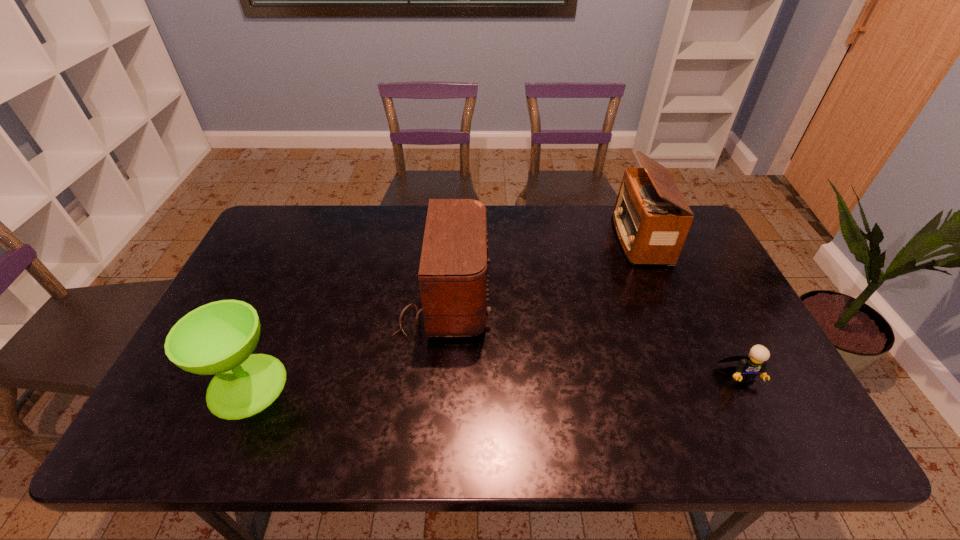
At what (x,y) coordinates should I click in order to perform the action: click on free space at the right edge. Please return your answer as a coordinate pair (x, y). The height and width of the screenshot is (540, 960). Looking at the image, I should click on (702, 314).

Locate an element on the screen. The height and width of the screenshot is (540, 960). vacant space at the far left corner of the desktop is located at coordinates (294, 237).

The image size is (960, 540). Find the location of `vacant space in between the leftmost object and the shortest object`. vacant space in between the leftmost object and the shortest object is located at coordinates (494, 380).

The width and height of the screenshot is (960, 540). Find the location of `empty location between the right radio receiver and the shortest object`. empty location between the right radio receiver and the shortest object is located at coordinates (690, 307).

At what (x,y) coordinates should I click in order to perform the action: click on vacant area between the Lego and the right radio receiver. Please return your answer as a coordinate pair (x, y). Looking at the image, I should click on (690, 307).

Find the location of a particular element. free space between the second object from left to right and the right radio receiver is located at coordinates (541, 268).

The image size is (960, 540). Identify the location of free point between the shortest object and the leftmost object. (494, 380).

Where is `free point between the left radio receiver and the Lego`? free point between the left radio receiver and the Lego is located at coordinates [x=592, y=337].

At what (x,y) coordinates should I click in order to perform the action: click on vacant space that is in between the third object from right to left and the Lego. Please return your answer as a coordinate pair (x, y). This screenshot has height=540, width=960. Looking at the image, I should click on coord(592,337).

The image size is (960, 540). In order to click on empty space that is in between the right radio receiver and the left radio receiver in this screenshot , I will do `click(541, 268)`.